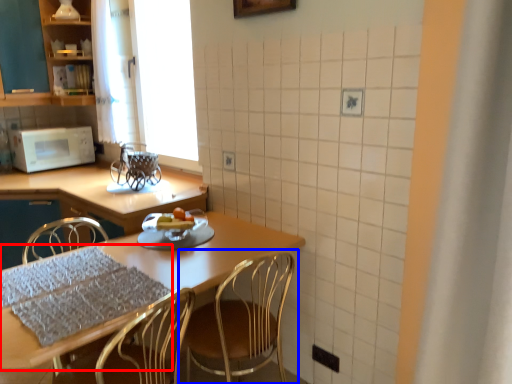
Question: Among these objects, which one is farthest to the camera, tablecloth (highlighted by a red box) or chair (highlighted by a blue box)?

Choices:
 (A) tablecloth
 (B) chair

Answer: (A)